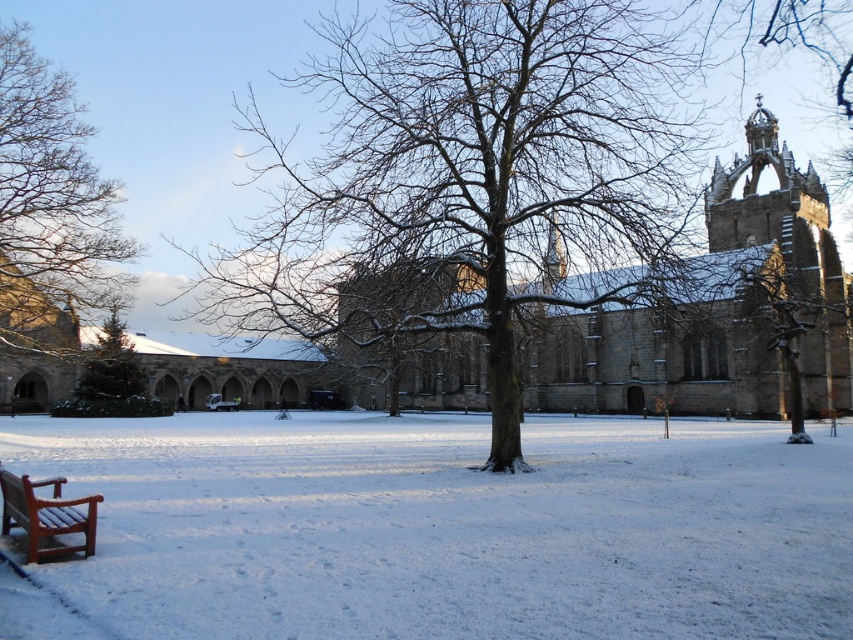
Question: Among these points, which one is farthest from the camera?

Choices:
 (A) (96, 515)
 (B) (770, 300)
 (C) (397, 544)

Answer: (B)

Question: Can you confirm if brown stone church at center is positioned to the right of bare wood tree at left?

Choices:
 (A) no
 (B) yes

Answer: (B)

Question: Which of the following is the farthest from the observer?

Choices:
 (A) (775, 332)
 (B) (74, 220)

Answer: (B)

Question: In this image, where is smooth brown tree trunk at right located relative to wooden park bench at lower left?

Choices:
 (A) below
 (B) above

Answer: (B)

Question: Which object is the farthest from the snow-covered tree at center?

Choices:
 (A) white powdery snow at lower left
 (B) wooden park bench at lower left
 (C) bare wood tree at left

Answer: (B)

Question: Is snow-covered tree at center to the left of bare wood tree at left from the viewer's perspective?

Choices:
 (A) yes
 (B) no

Answer: (B)